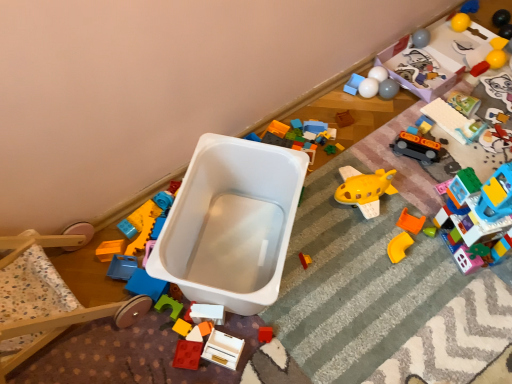
Image resolution: width=512 pixels, height=384 pixels. Identify the location of vacant area in front of orange plastic block at lower right, placed as the 10th toy when sorted from left to right. (421, 276).